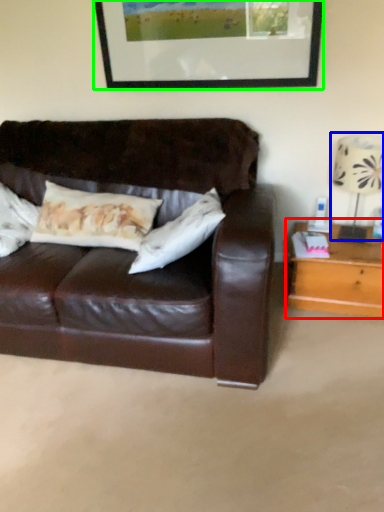
Question: Which object is positioned closest to table (highlighted by a red box)? Select from table lamp (highlighted by a blue box) and picture frame (highlighted by a green box).

Choices:
 (A) table lamp
 (B) picture frame

Answer: (A)